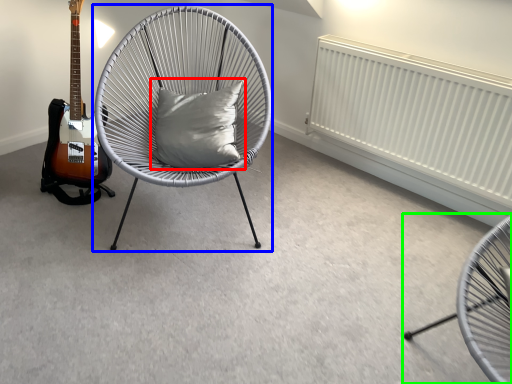
Question: Which object is the farthest from pillow (highlighted by a red box)? Choose among these: chair (highlighted by a blue box) or chair (highlighted by a green box).

Choices:
 (A) chair
 (B) chair

Answer: (B)